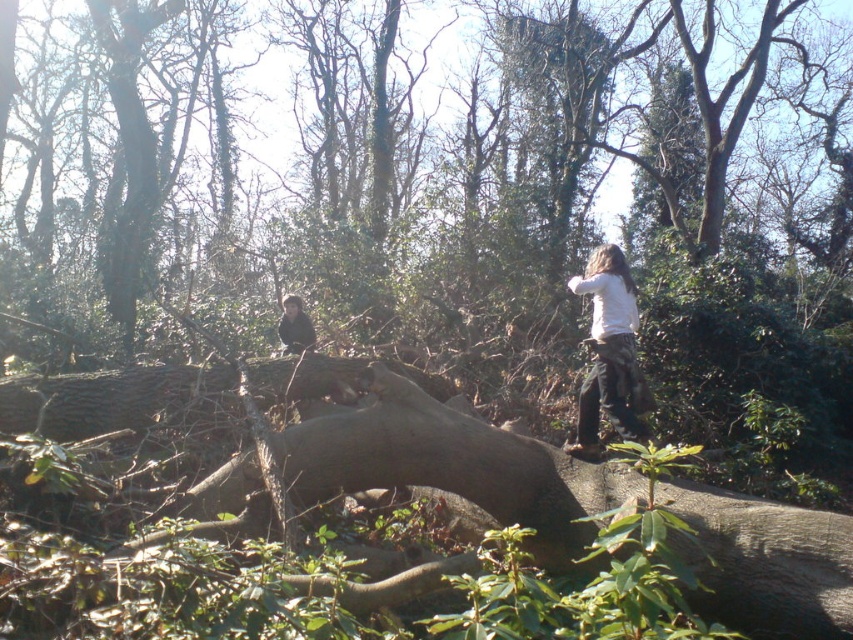
You are a hiker who has just arrived at this forest scene. You notice a white cotton shirt at center and a dark brown hair at upper center. Which object takes up more space in the image?

The white cotton shirt at center is bigger than the dark brown hair at upper center, so it takes up more space in the image.

You are a hiker who wants to place a 5 meter long rope between the brown rough tree trunk at center and the dark brown hair at upper center. Can you do it?

The distance between the brown rough tree trunk at center and the dark brown hair at upper center is 4.73 meters. Since the rope is 5 meters long, it is slightly longer than the required distance. Therefore, the rope can be placed between them with some slack remaining.